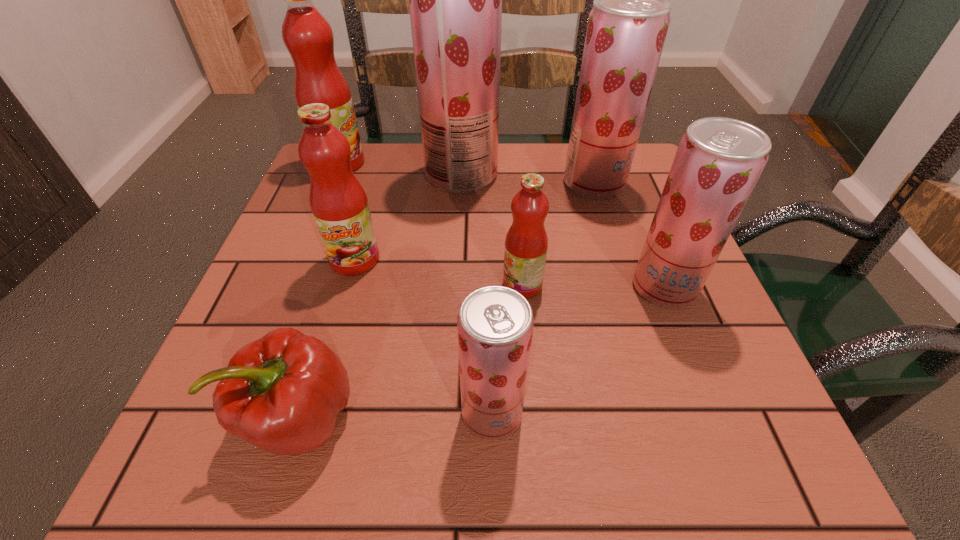
What are the coordinates of `the tallest fruit juice` in the screenshot? It's located at (455, 0).

The width and height of the screenshot is (960, 540). What are the coordinates of `the biggest strawberry fruit juice` in the screenshot? It's located at (x=455, y=0).

I want to click on the biggest pink fruit juice, so click(x=307, y=35).

Image resolution: width=960 pixels, height=540 pixels. I want to click on the third smallest strawberry fruit juice, so tap(627, 26).

You are a GUI agent. You are given a task and a screenshot of the screen. Output one action in this format:
    pyautogui.click(x=<x>, y=<y>)
    Task: Click on the second biggest pink fruit juice
    Image resolution: width=960 pixels, height=540 pixels.
    Given the screenshot: What is the action you would take?
    pyautogui.click(x=339, y=205)

Image resolution: width=960 pixels, height=540 pixels. I want to click on the second smallest strawberry fruit juice, so click(719, 160).

At what (x,y) coordinates should I click in order to perform the action: click on the nearest strawberry fruit juice. Please return your answer as a coordinate pair (x, y). The image size is (960, 540). Looking at the image, I should click on (495, 324).

You are a GUI agent. You are given a task and a screenshot of the screen. Output one action in this format:
    pyautogui.click(x=<x>, y=<y>)
    Task: Click on the nearest fruit juice
    Image resolution: width=960 pixels, height=540 pixels.
    Given the screenshot: What is the action you would take?
    pyautogui.click(x=495, y=324)

The image size is (960, 540). In order to click on the rightmost pink fruit juice in this screenshot , I will do 526,243.

This screenshot has height=540, width=960. Find the location of `the shortest object`. the shortest object is located at coordinates (283, 392).